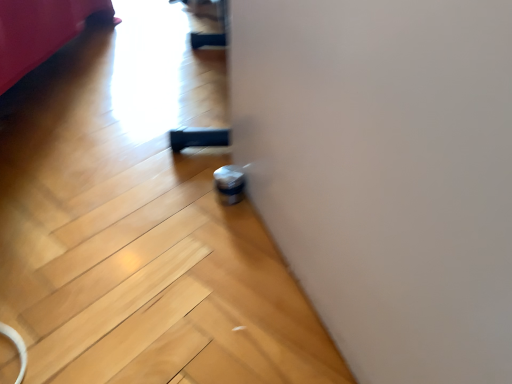
Image resolution: width=512 pixels, height=384 pixels. What are the coordinates of `matte red bed at upper left` in the screenshot? It's located at (42, 31).

Measure the distance between point (106, 13) and camera.

Point (106, 13) and camera are 1.95 meters apart.

The width and height of the screenshot is (512, 384). Describe the element at coordinates (42, 31) in the screenshot. I see `matte red bed at upper left` at that location.

Find the location of `matte red bed at upper left`. matte red bed at upper left is located at coordinates (42, 31).